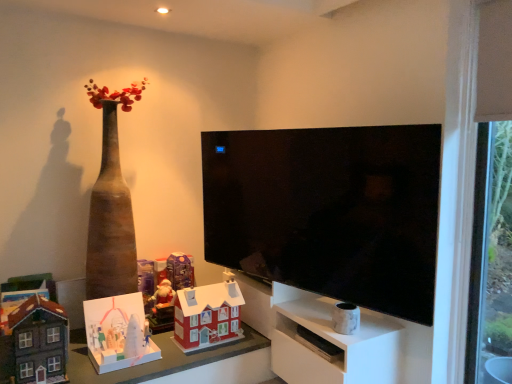
Identify the location of unoccupied region to the right of white marble vase at lower right, which is counted as the 1th toy, starting from the right. Image resolution: width=512 pixels, height=384 pixels. (378, 325).